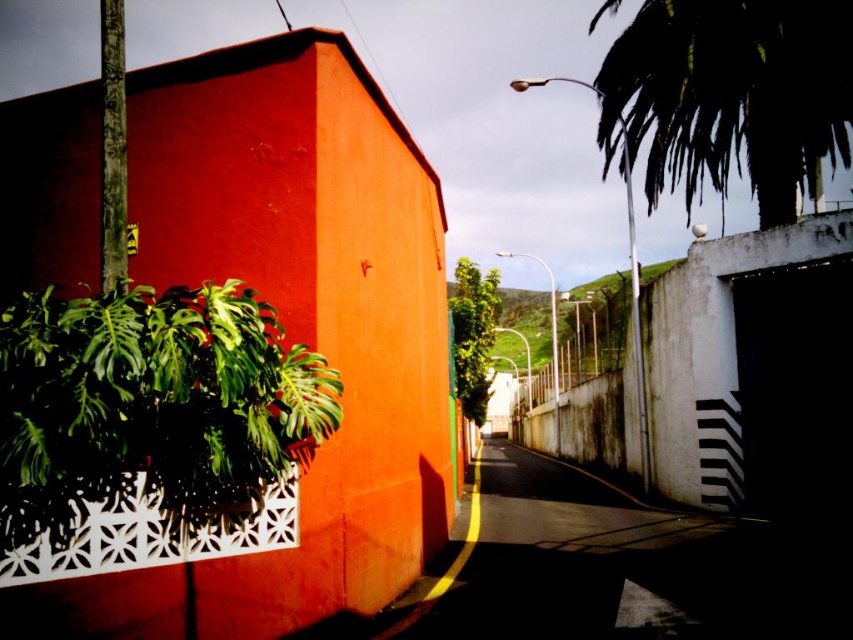
You are a delivery person trying to navigate through the street. The green leafy plant at left and the dark asphalt at center are in your path. Which one is wider so you can choose the better route?

The dark asphalt at center is wider than the green leafy plant at left, so you should choose the dark asphalt at center for a better route.

You are a delivery drone flying above the urban street scene. You need to land on the dark asphalt at center. The green leafy plant at left is blocking your path. Can you safely navigate around it?

The green leafy plant at left is closer to the viewer than the dark asphalt at center, so the drone can safely navigate around it as the plant is not in the direct path of landing on the asphalt.